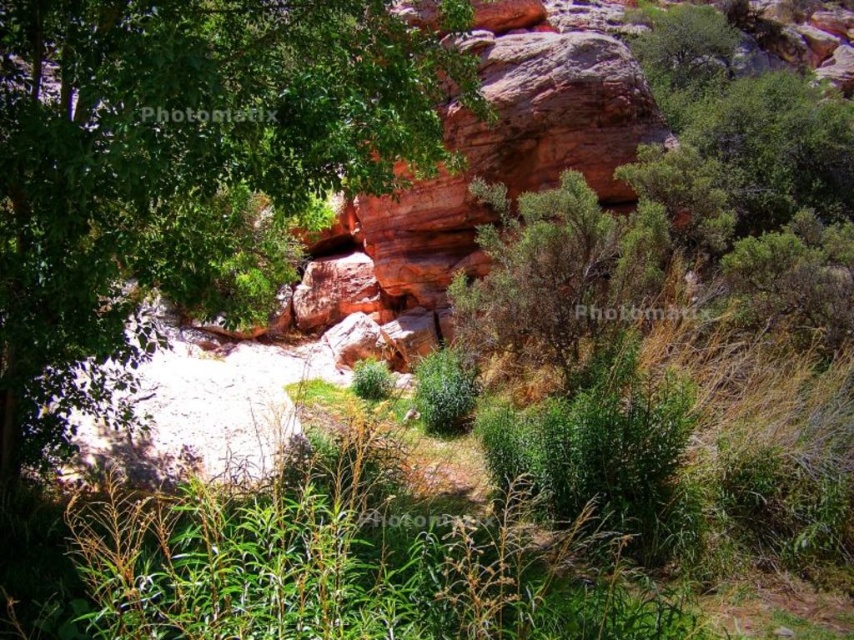
Is reddish-brown rock at center below green leafy bush at center?

No, reddish-brown rock at center is not below green leafy bush at center.

Does reddish-brown rock at center appear over green leafy bush at center?

Indeed, reddish-brown rock at center is positioned over green leafy bush at center.

Between point (455, 192) and point (665, 244), which one is positioned in front?

Point (665, 244) is in front.

Identify the location of reddish-brown rock at center. (484, 172).

Can you confirm if green leafy tree at upper left is positioned to the right of green leafy bush at center?

Incorrect, green leafy tree at upper left is not on the right side of green leafy bush at center.

Which is more to the left, green leafy tree at upper left or green leafy bush at center?

green leafy tree at upper left is more to the left.

Does point (62, 253) come in front of point (477, 333)?

Yes, point (62, 253) is in front of point (477, 333).

Locate an element on the screen. green leafy tree at upper left is located at coordinates (185, 170).

Does green leafy tree at upper left appear on the right side of reddish-brown rock at center?

Incorrect, green leafy tree at upper left is not on the right side of reddish-brown rock at center.

Between green leafy tree at upper left and reddish-brown rock at center, which one appears on the right side from the viewer's perspective?

reddish-brown rock at center

Who is more distant from viewer, (x=273, y=276) or (x=466, y=116)?

The point (x=466, y=116) is behind.

At what (x,y) coordinates should I click in order to perform the action: click on green leafy tree at upper left. Please return your answer as a coordinate pair (x, y). This screenshot has width=854, height=640. Looking at the image, I should click on (185, 170).